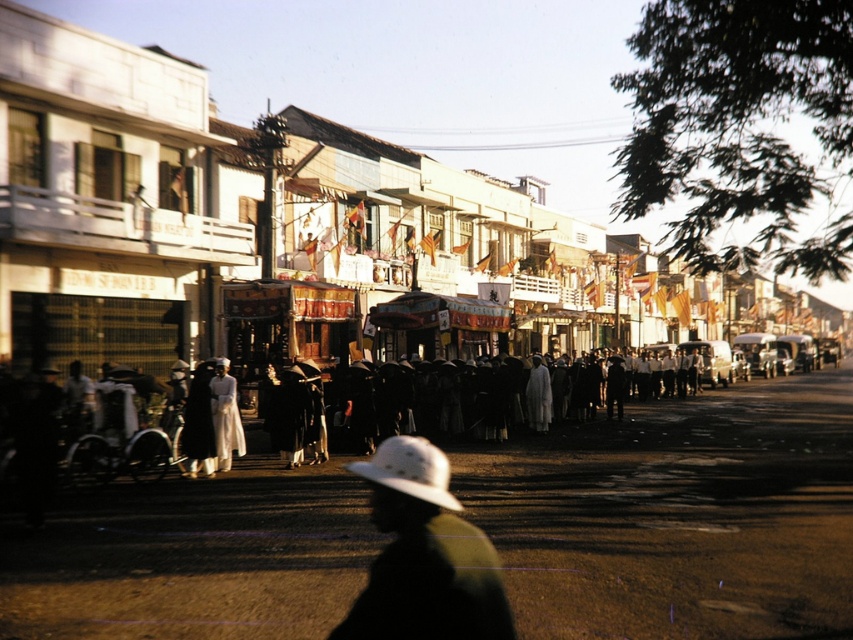
Between white felt hat at center and white satin dress at center, which one appears on the right side from the viewer's perspective?

Positioned to the right is white felt hat at center.

Between white felt hat at center and white satin dress at center, which one is positioned higher?

Positioned higher is white satin dress at center.

Between point (444, 618) and point (216, 392), which one is positioned in front?

Point (444, 618)

Locate an element on the screen. The image size is (853, 640). white felt hat at center is located at coordinates (424, 556).